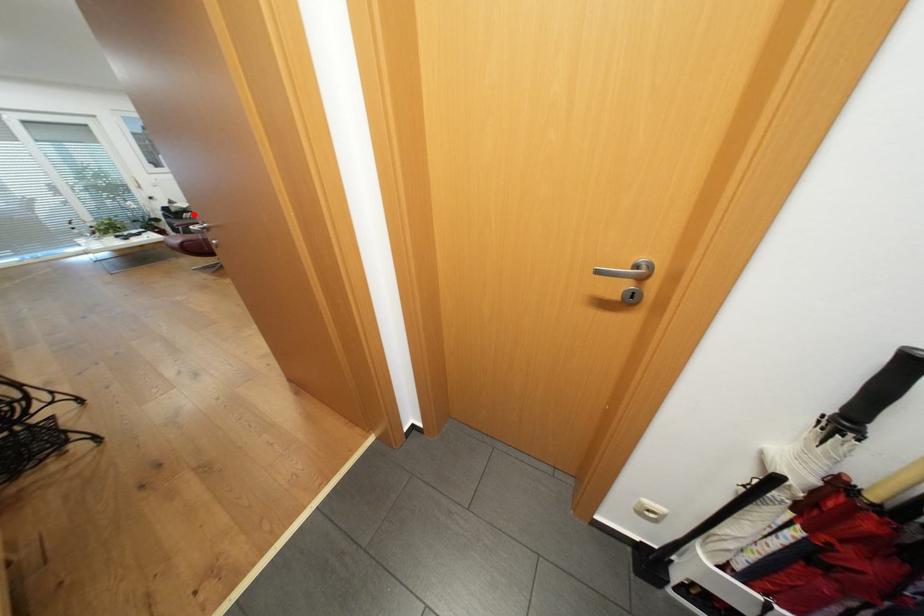
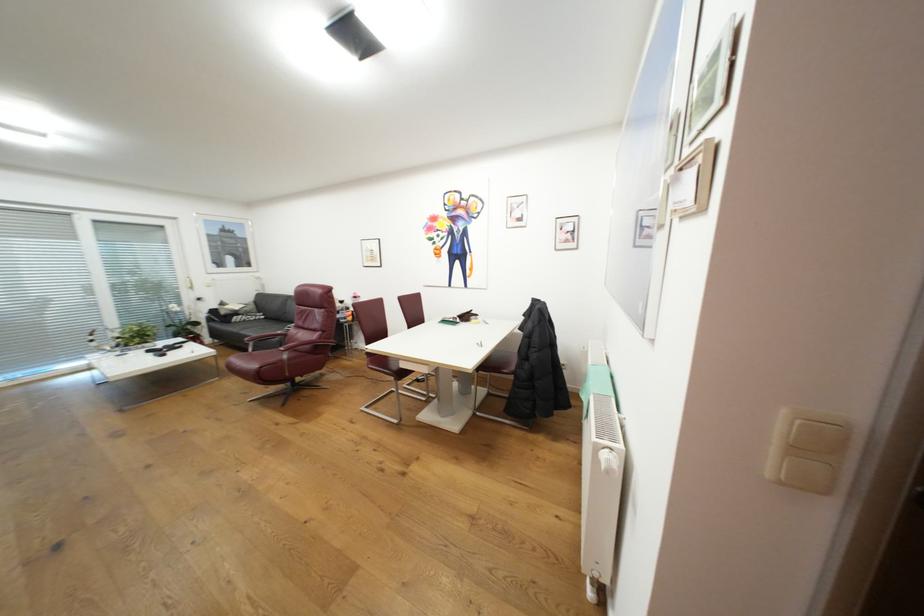
Where in the second image is the point corresponding to the highlighted location from the first image?

(244, 318)